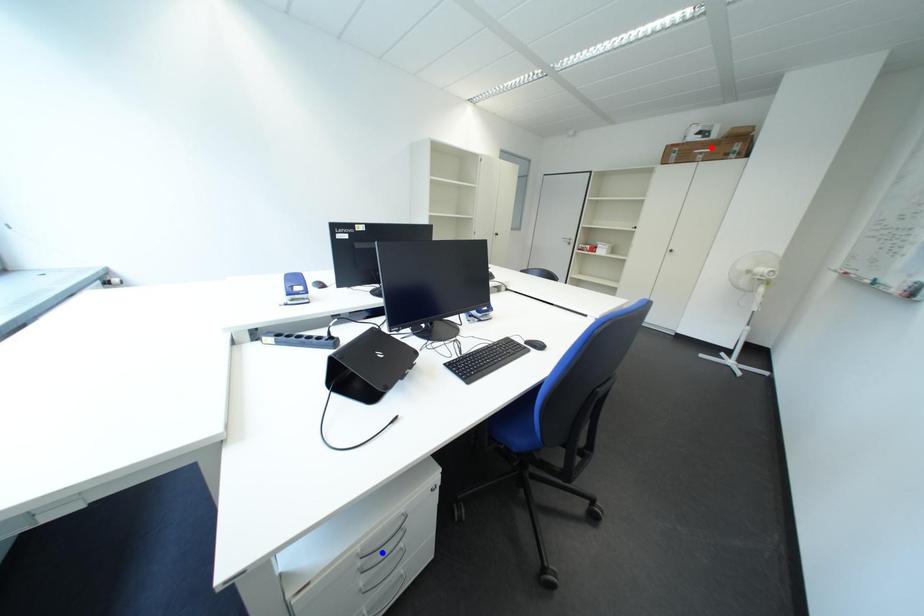
Question: Which of the two points in the image is closer to the camera?

Choices:
 (A) Blue point is closer.
 (B) Red point is closer.

Answer: (A)